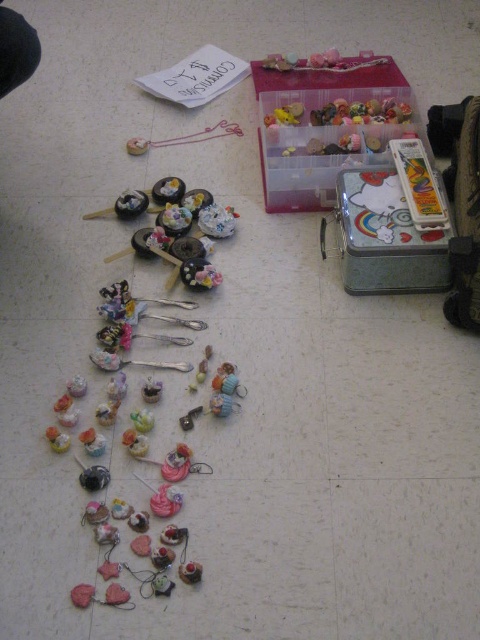
Who is higher up, pink glossy cupcake at lower left or metallic silver charm at center?

metallic silver charm at center is above.

Who is more forward, [49,426] or [152,401]?

Positioned in front is point [49,426].

Does point (59, 451) lie behind point (158, 385)?

No, (59, 451) is in front of (158, 385).

Find the location of `pink glossy cupcake at lower left`. pink glossy cupcake at lower left is located at coordinates click(x=57, y=440).

Does matte plastic cupcakes at upper center lie behind pink glossy cupcake at lower left?

That is True.

Does matte plastic cupcakes at upper center have a lesser height compared to pink glossy cupcake at lower left?

No, matte plastic cupcakes at upper center is not shorter than pink glossy cupcake at lower left.

Between point (175, 248) and point (60, 429), which one is positioned in front?

Point (60, 429)

The width and height of the screenshot is (480, 640). Find the location of `matte plastic cupcakes at upper center`. matte plastic cupcakes at upper center is located at coordinates (183, 236).

Between matte plastic cupcakes at upper center and metallic silver charm at center, which one appears on the right side from the viewer's perspective?

matte plastic cupcakes at upper center

Is point (117, 257) farther from camera compared to point (155, 396)?

Yes, it is behind point (155, 396).

Does point (186, 269) come behind point (145, 392)?

Yes, point (186, 269) is farther from viewer.

Image resolution: width=480 pixels, height=640 pixels. In order to click on matte plastic cupcakes at upper center in this screenshot , I will do `click(183, 236)`.